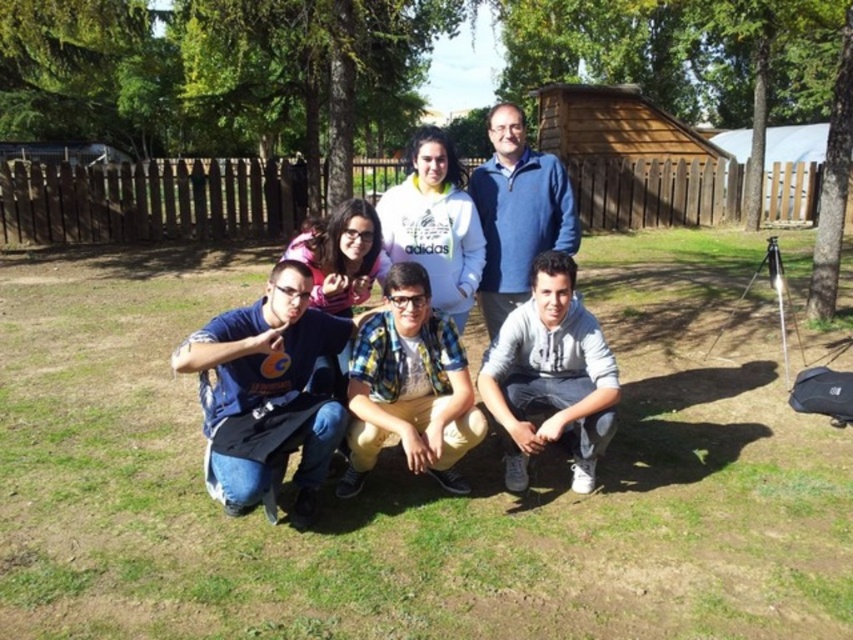
From the picture: Between blue cotton t-shirt at lower left and gray cotton hoodie at lower right, which one has less height?

Standing shorter between the two is blue cotton t-shirt at lower left.

Who is more forward, (251,369) or (569,280)?

Positioned in front is point (251,369).

You are a GUI agent. You are given a task and a screenshot of the screen. Output one action in this format:
    pyautogui.click(x=<x>, y=<y>)
    Task: Click on the blue cotton t-shirt at lower left
    The image size is (853, 640).
    Given the screenshot: What is the action you would take?
    pyautogui.click(x=265, y=392)

Consider the image. Who is positioned more to the right, green grass at lower center or gray cotton hoodie at lower right?

gray cotton hoodie at lower right

From the picture: Can you confirm if green grass at lower center is positioned below gray cotton hoodie at lower right?

Yes.

You are a GUI agent. You are given a task and a screenshot of the screen. Output one action in this format:
    pyautogui.click(x=<x>, y=<y>)
    Task: Click on the green grass at lower center
    This screenshot has height=640, width=853.
    Given the screenshot: What is the action you would take?
    pyautogui.click(x=419, y=477)

Locate an element on the screen. The width and height of the screenshot is (853, 640). green grass at lower center is located at coordinates (419, 477).

Can you confirm if green grass at lower center is taller than wooden hut at upper center?

No.

At what (x,y) coordinates should I click in order to perform the action: click on green grass at lower center. Please return your answer as a coordinate pair (x, y). The image size is (853, 640). Looking at the image, I should click on (419, 477).